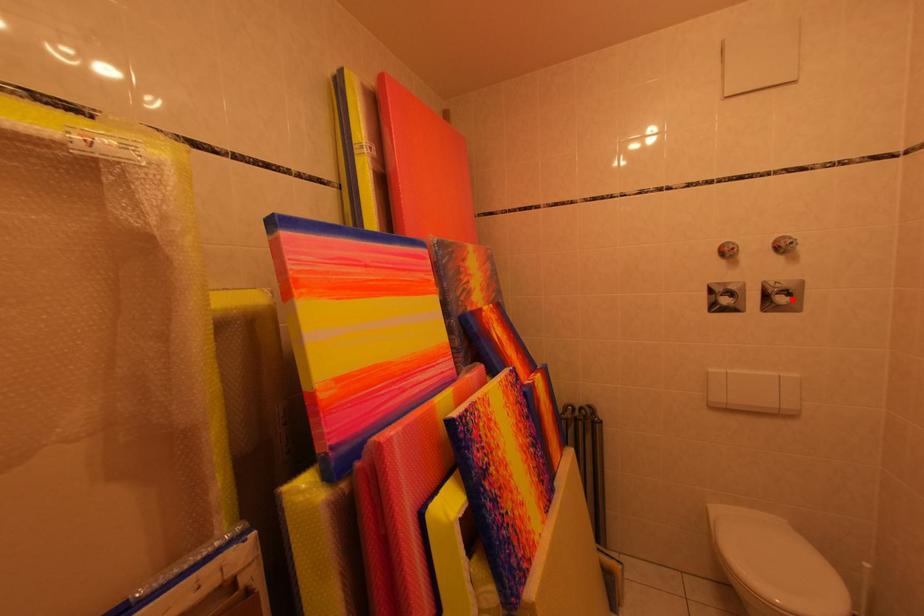
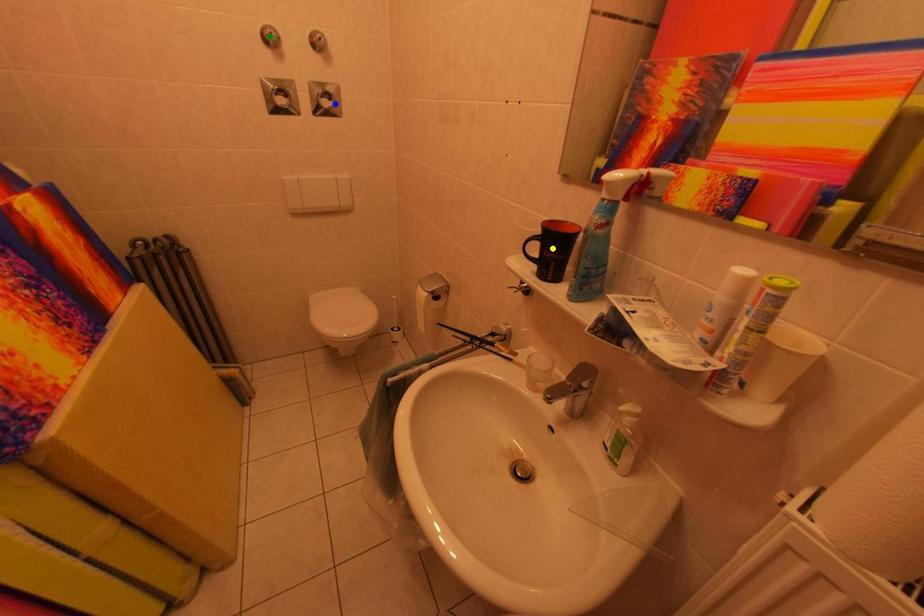
Question: I am providing you with two images of the same scene from different viewpoints. A red point is marked on the first image. You are given multiple points on the second image. Which point in image 2 represents the same 3d spot as the red point in image 1?

Choices:
 (A) green point
 (B) blue point
 (C) yellow point

Answer: (B)